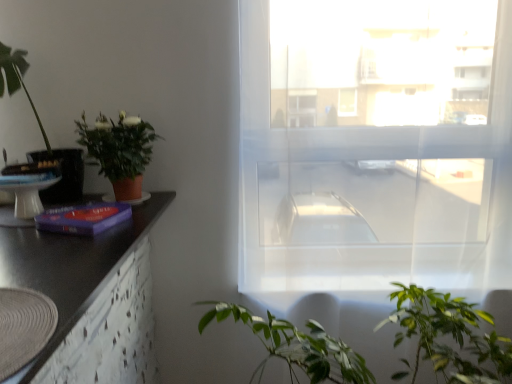
Question: Does purple matte book at left appear on the right side of green leafy plant at left, which appears as the 1th houseplant when viewed from the left?

Choices:
 (A) yes
 (B) no

Answer: (A)

Question: Is purple matte book at left located outside green leafy plant at left, which appears as the 1th houseplant when viewed from the left?

Choices:
 (A) yes
 (B) no

Answer: (A)

Question: From a real-world perspective, is purple matte book at left beneath green leafy plant at left, which appears as the 1th houseplant when viewed from the left?

Choices:
 (A) no
 (B) yes

Answer: (B)

Question: Is purple matte book at left at the left side of green leafy plant at left, which appears as the 1th houseplant when viewed from the left?

Choices:
 (A) yes
 (B) no

Answer: (B)

Question: From a real-world perspective, is purple matte book at left positioned over green leafy plant at left, which appears as the 1th houseplant when viewed from the left, based on gravity?

Choices:
 (A) no
 (B) yes

Answer: (A)

Question: Considering the relative sizes of purple matte book at left and green leafy plant at left, the second houseplant positioned from the right, in the image provided, is purple matte book at left bigger than green leafy plant at left, the second houseplant positioned from the right,?

Choices:
 (A) yes
 (B) no

Answer: (B)

Question: From a real-world perspective, is matte terracotta pot at left, the 1th houseplant positioned from the right, on black matte counter top at left?

Choices:
 (A) yes
 (B) no

Answer: (A)

Question: Can you confirm if matte terracotta pot at left, the 1th houseplant positioned from the right, is thinner than black matte counter top at left?

Choices:
 (A) no
 (B) yes

Answer: (B)

Question: Is matte terracotta pot at left, the second houseplant in the left-to-right sequence, smaller than black matte counter top at left?

Choices:
 (A) no
 (B) yes

Answer: (B)

Question: From a real-world perspective, is matte terracotta pot at left, the second houseplant in the left-to-right sequence, physically below black matte counter top at left?

Choices:
 (A) yes
 (B) no

Answer: (B)

Question: Can you confirm if matte terracotta pot at left, the second houseplant in the left-to-right sequence, is shorter than black matte counter top at left?

Choices:
 (A) yes
 (B) no

Answer: (A)

Question: Are matte terracotta pot at left, the 1th houseplant positioned from the right, and black matte counter top at left beside each other?

Choices:
 (A) yes
 (B) no

Answer: (B)

Question: Considering the relative sizes of transparent fabric window at center and purple matte book at left in the image provided, is transparent fabric window at center shorter than purple matte book at left?

Choices:
 (A) yes
 (B) no

Answer: (B)